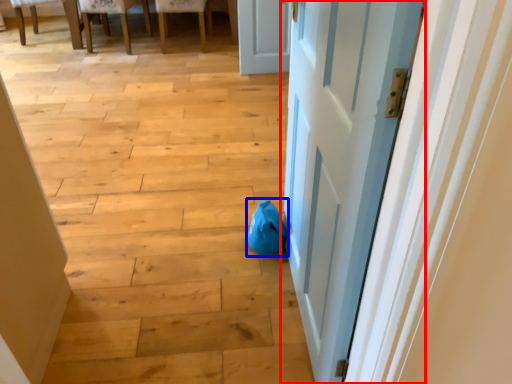
Question: Among these objects, which one is nearest to the camera, door (highlighted by a red box) or bean bag chair (highlighted by a blue box)?

Choices:
 (A) door
 (B) bean bag chair

Answer: (A)